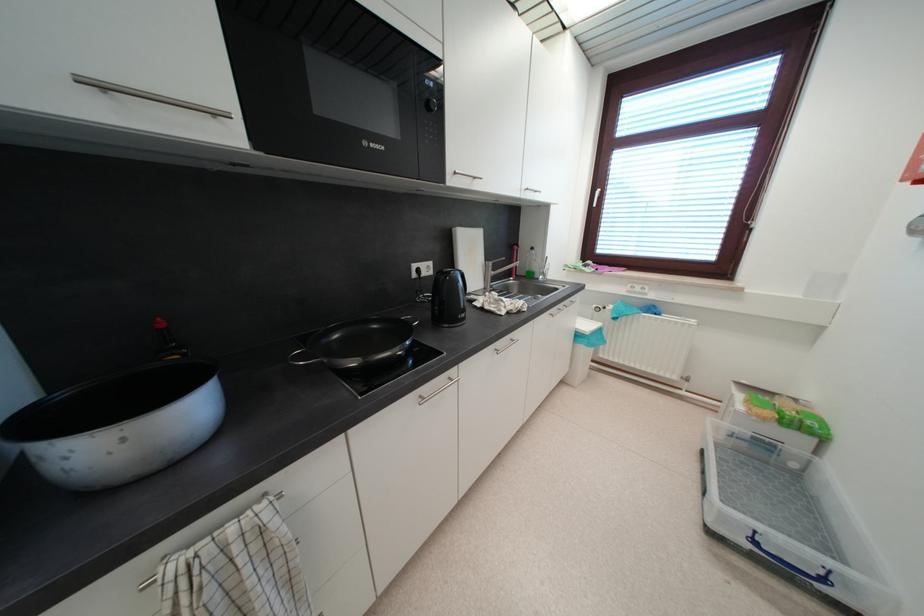
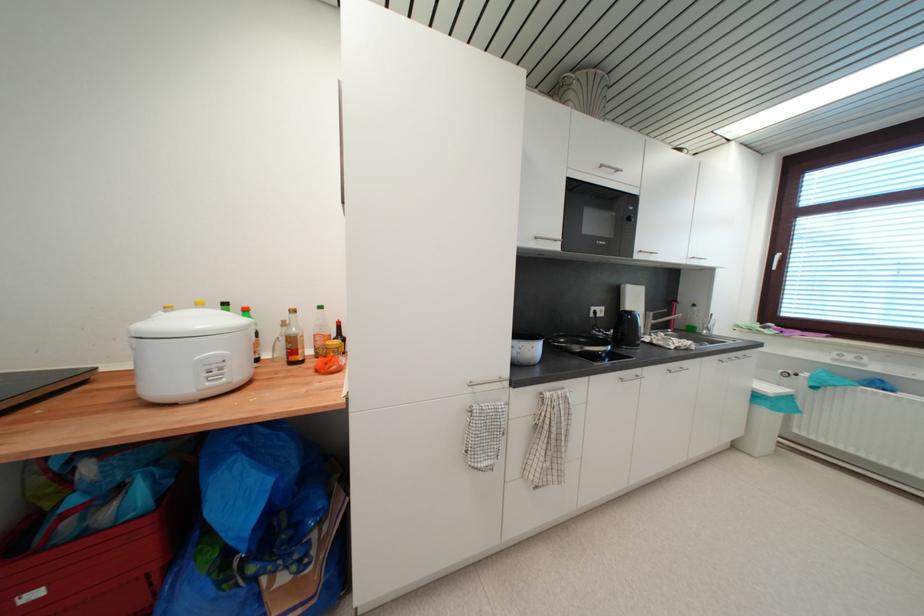
Find the pixel in the second image that matches pixel 604 333 in the first image.

(795, 400)